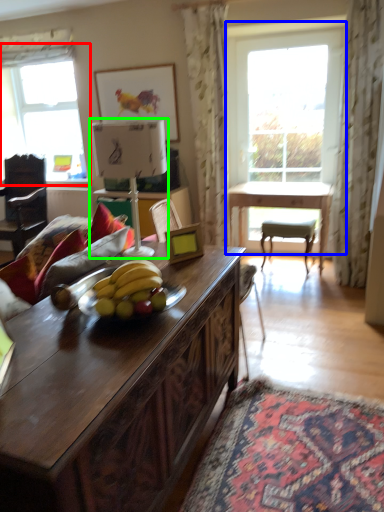
Question: Which is nearer to the window (highlighted by a red box)? window (highlighted by a blue box) or lamp (highlighted by a green box).

Choices:
 (A) window
 (B) lamp

Answer: (A)